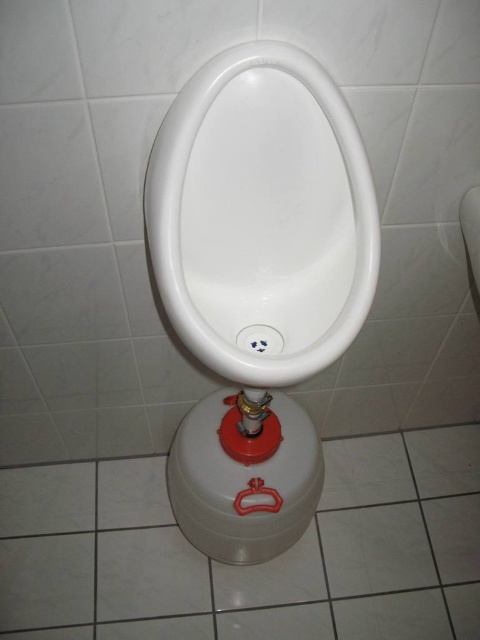
Describe the element at coordinates (262, 216) in the screenshot. I see `white glossy urinal at center` at that location.

Identify the location of white glossy urinal at center. (262, 216).